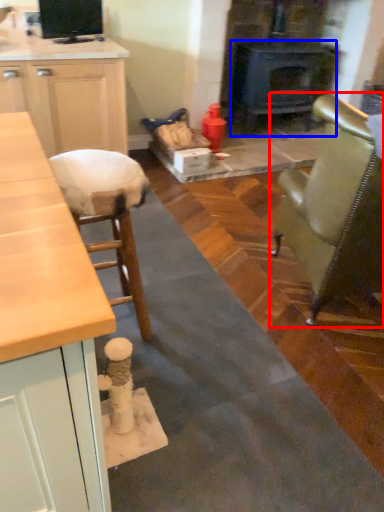
Question: Which of the following is the closest to the observer, chair (highlighted by a red box) or wood burning stove (highlighted by a blue box)?

Choices:
 (A) chair
 (B) wood burning stove

Answer: (A)